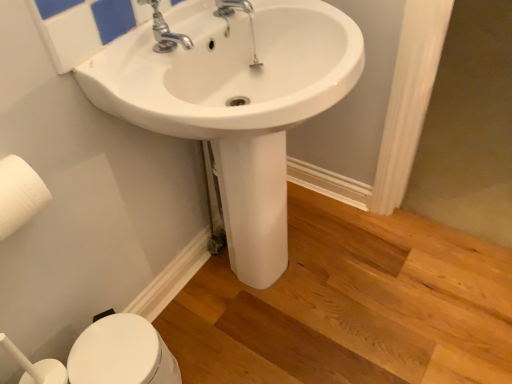
Question: From a real-world perspective, does white glossy sink at center sit lower than white matte toilet paper at left?

Choices:
 (A) no
 (B) yes

Answer: (B)

Question: Is white matte toilet paper at left located within white glossy sink at center?

Choices:
 (A) no
 (B) yes

Answer: (A)

Question: Can you confirm if white glossy sink at center is smaller than white matte toilet paper at left?

Choices:
 (A) yes
 (B) no

Answer: (B)

Question: Is white glossy sink at center positioned behind white matte toilet paper at left?

Choices:
 (A) no
 (B) yes

Answer: (A)

Question: From a real-world perspective, is white glossy sink at center physically above white matte toilet paper at left?

Choices:
 (A) no
 (B) yes

Answer: (A)

Question: Would you say white glossy bidet at lower left is to the left or to the right of polished chrome faucet at upper center in the picture?

Choices:
 (A) right
 (B) left

Answer: (B)

Question: Is white glossy bidet at lower left bigger or smaller than polished chrome faucet at upper center?

Choices:
 (A) small
 (B) big

Answer: (B)

Question: Do you think white glossy bidet at lower left is within polished chrome faucet at upper center, or outside of it?

Choices:
 (A) outside
 (B) inside

Answer: (A)

Question: Does point (125, 349) appear closer or farther from the camera than point (155, 19)?

Choices:
 (A) closer
 (B) farther

Answer: (B)

Question: From a real-world perspective, is white glossy sink at center physically located above or below white matte toilet paper at left?

Choices:
 (A) below
 (B) above

Answer: (A)

Question: Is point (297, 54) closer or farther from the camera than point (12, 170)?

Choices:
 (A) farther
 (B) closer

Answer: (A)

Question: Would you say white glossy sink at center is to the left or to the right of white matte toilet paper at left in the picture?

Choices:
 (A) left
 (B) right

Answer: (B)

Question: Considering the positions of white glossy sink at center and white matte toilet paper at left in the image, is white glossy sink at center wider or thinner than white matte toilet paper at left?

Choices:
 (A) wide
 (B) thin

Answer: (A)

Question: Looking at their shapes, would you say white matte toilet paper at left is wider or thinner than white glossy sink at center?

Choices:
 (A) thin
 (B) wide

Answer: (A)

Question: Based on their positions, is white matte toilet paper at left located to the left or right of white glossy sink at center?

Choices:
 (A) left
 (B) right

Answer: (A)